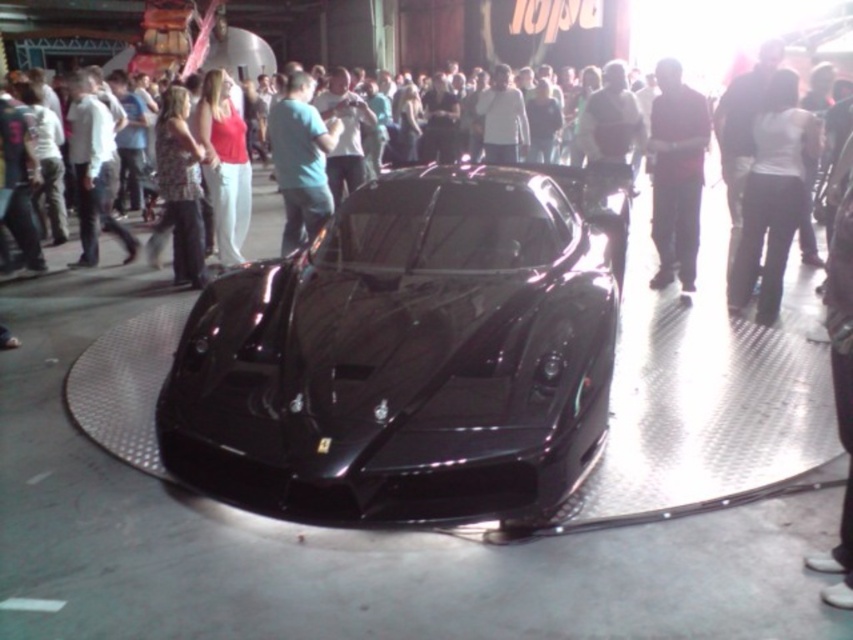
Between white matte shirt at upper center and floral-patterned blouse at center, which one is positioned lower?

white matte shirt at upper center is lower down.

The image size is (853, 640). What do you see at coordinates (772, 195) in the screenshot? I see `white matte shirt at upper center` at bounding box center [772, 195].

This screenshot has height=640, width=853. In order to click on white matte shirt at upper center in this screenshot , I will do `click(772, 195)`.

Who is higher up, matte red shirt at center or floral-patterned blouse at center?

Positioned higher is matte red shirt at center.

Who is more distant from viewer, (202, 90) or (181, 180)?

The point (202, 90) is behind.

Who is more distant from viewer, [212,161] or [201,147]?

The point [201,147] is behind.

Find the location of `matte red shirt at center`. matte red shirt at center is located at coordinates (224, 163).

How distant is glossy black car at center from dark red shirt at center?

glossy black car at center and dark red shirt at center are 2.91 meters apart.

This screenshot has height=640, width=853. I want to click on glossy black car at center, so click(403, 358).

The height and width of the screenshot is (640, 853). What are the coordinates of `glossy black car at center` in the screenshot? It's located at (403, 358).